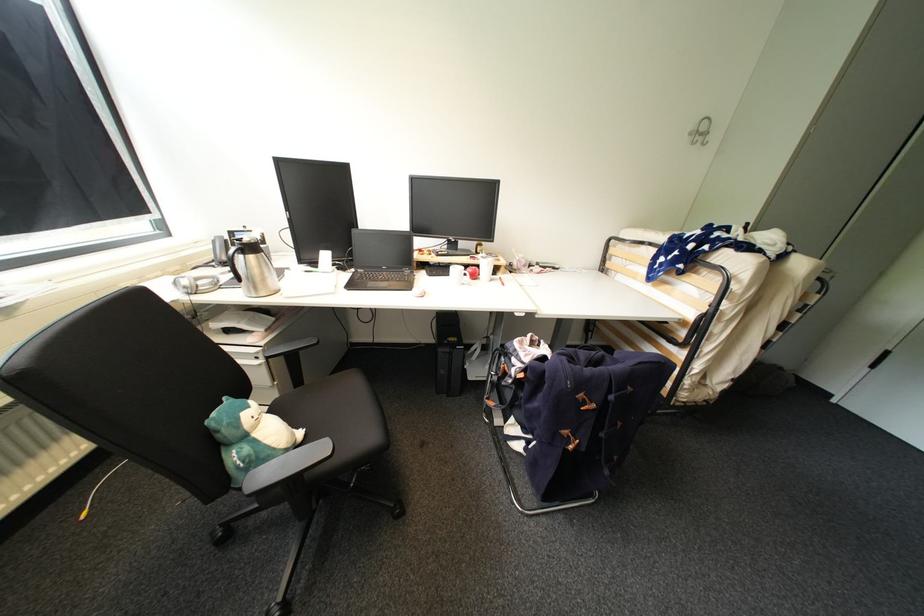
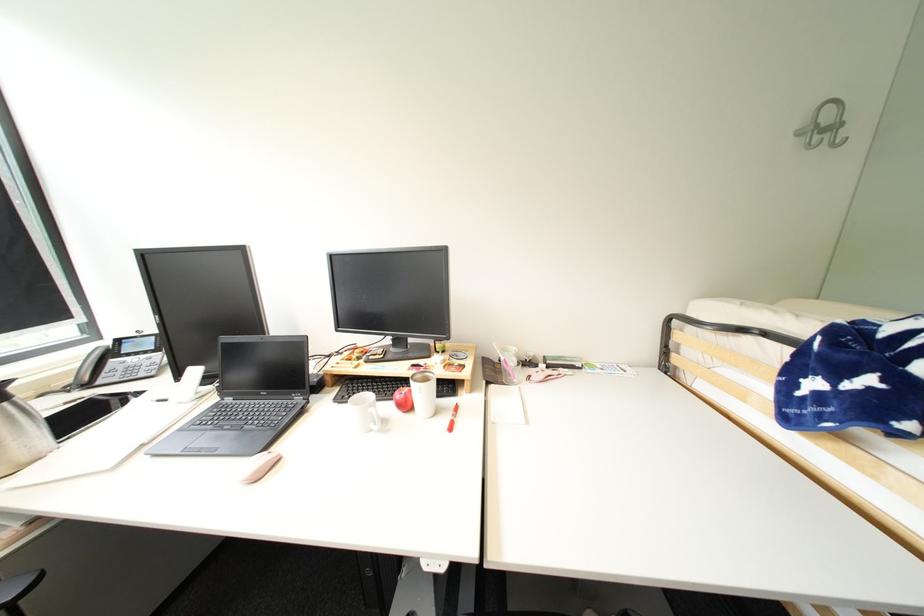
In the second image, find the point that corresponds to the point at 427,294 in the first image.

(254, 480)